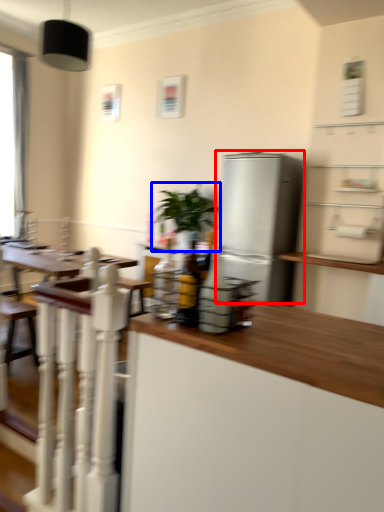
Question: Among these objects, which one is nearest to the camera, refrigerator (highlighted by a red box) or houseplant (highlighted by a blue box)?

Choices:
 (A) refrigerator
 (B) houseplant

Answer: (A)